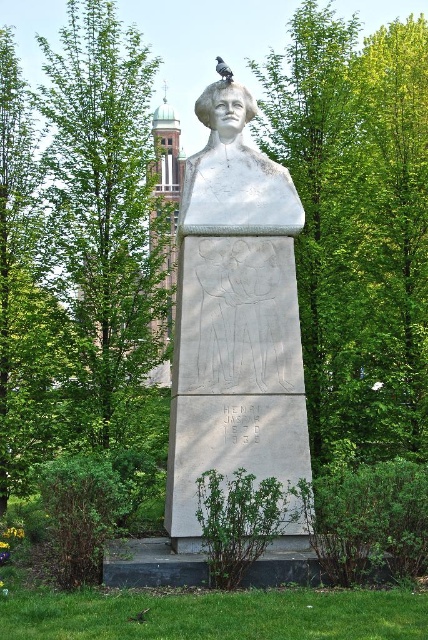
You are a photographer standing at the point marked by the coordinates (234, 316). Looking at the statue of the woman with the voluminous hair and necklace, and the pedestal with the inscription, can you tell me what object you are currently standing on?

The point marked by the coordinates (234, 316) is on the white stone bust at center, so you are standing on the white stone bust at center.

Based on the photo, you are standing in front of the statue and want to place a small flower bouquet exactly at the base of the white stone bust at center. According to the coordinates provided, where should you place the bouquet?

The white stone bust at center is positioned at coordinates point (234, 316), so you should place the bouquet at the base of the white stone bust at center, which corresponds to the coordinates point (234, 316).

You are standing in front of the statue and notice a green leafy tree at upper left and a white marble bust at upper center. Which object is positioned to the left of the other?

The green leafy tree at upper left is positioned to the left of the white marble bust at upper center.